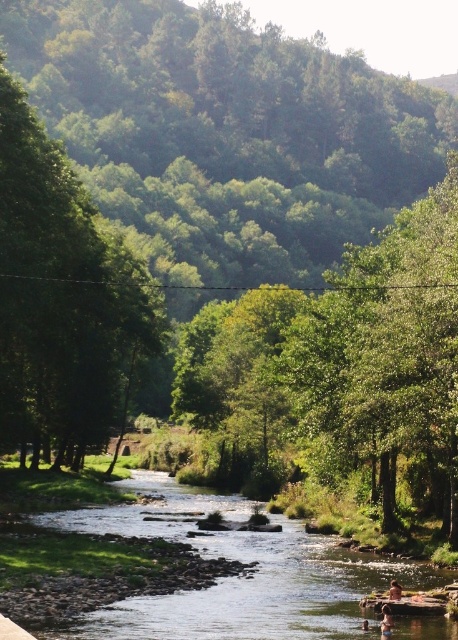
Is point (293, 547) positioned before point (391, 620)?

No, it is behind (391, 620).

Does clear water stream at center lie behind tan skin person at river center?

That is False.

Identify the location of clear water stream at center. (235, 577).

Does clear water stream at center have a greater height compared to smooth skin person at lower right?

Indeed, clear water stream at center has a greater height compared to smooth skin person at lower right.

Which is more to the right, clear water stream at center or smooth skin person at lower right?

smooth skin person at lower right

Image resolution: width=458 pixels, height=640 pixels. Find the location of `clear water stream at center`. clear water stream at center is located at coordinates (235, 577).

This screenshot has height=640, width=458. What are the coordinates of `clear water stream at center` in the screenshot? It's located at (235, 577).

Between tan skin person at river center and smooth skin person at lower right, which one is positioned lower?

smooth skin person at lower right

Which is above, tan skin person at river center or smooth skin person at lower right?

tan skin person at river center

What do you see at coordinates (386, 620) in the screenshot? I see `tan skin person at river center` at bounding box center [386, 620].

Where is `tan skin person at river center`? tan skin person at river center is located at coordinates (386, 620).